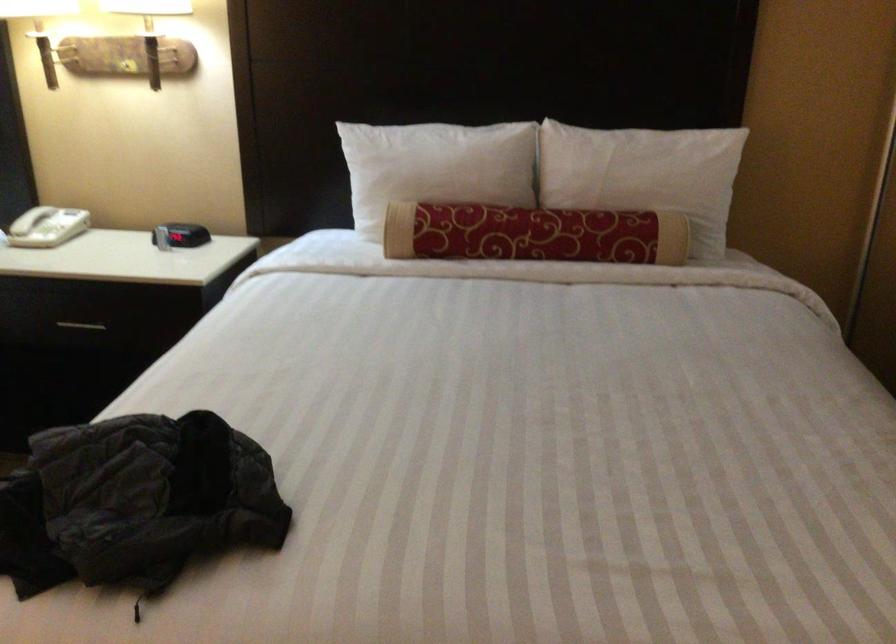
Find where to lift the black alarm clock. Please return your answer as a coordinate pair (x, y).

(183, 234)